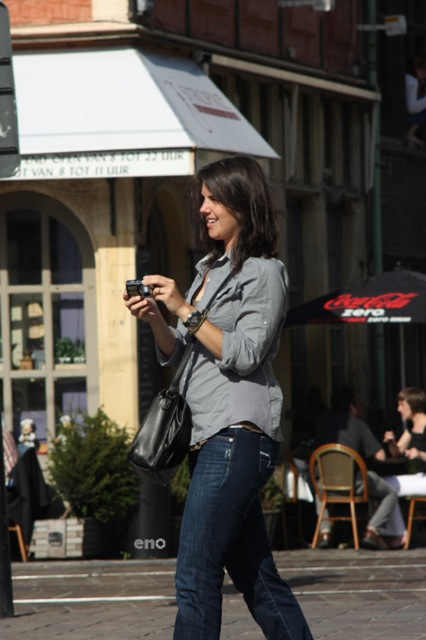
You are a fashion designer observing the scene. You need to create a new outfit that balances the proportions of the matte gray shirt at center and blue denim jeans at lower center. Which clothing item should you adjust to achieve a harmonious look?

The matte gray shirt at center is taller than the blue denim jeans at lower center. To achieve a harmonious look, you should shorten the length of the matte gray shirt at center so it matches the height of the blue denim jeans at lower center.